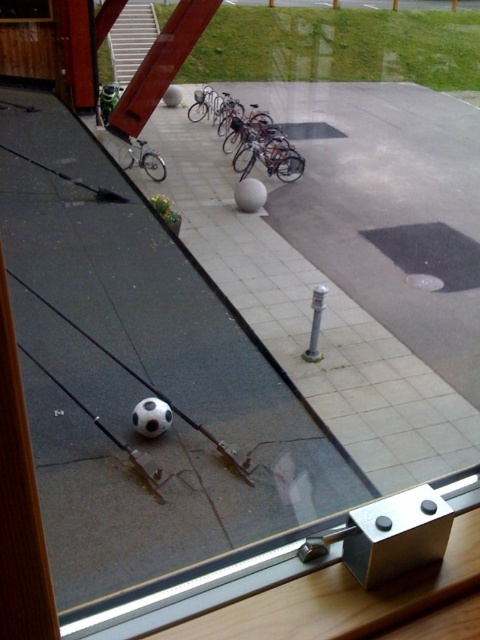
You are standing inside a building and see the transparent glass window at upper left and the silver metallic bicycle at center. Which object is positioned to the left when viewed from your perspective?

The transparent glass window at upper left is positioned to the left of the silver metallic bicycle at center from your perspective.

You are trying to determine if you can fit a large poster through the transparent glass door at center without bending it. The poster is as tall as the shiny metallic bicycles at center. Will the poster fit vertically through the door?

The transparent glass door at center is much taller than the shiny metallic bicycles at center, so the poster will fit vertically through the door without bending.